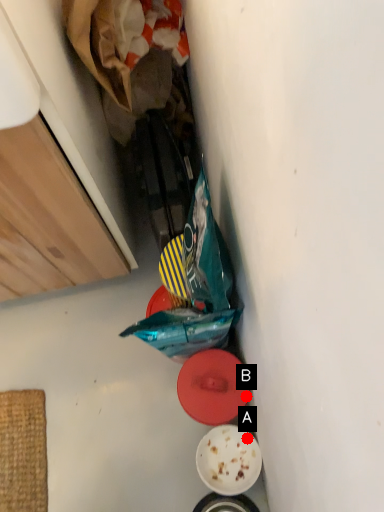
Question: Two points are circled on the image, labeled by A and B beside each circle. Among these points, which one is farthest from the camera?

Choices:
 (A) A is further
 (B) B is further

Answer: (A)